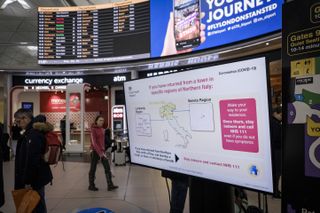
Identify the location of ceiling. (17, 12).